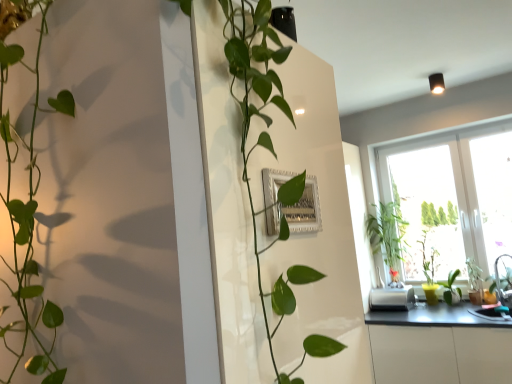
Where is `free space above green glossy plant at right, the 2th plant viewed from the right (from a real-world perspective)`? This screenshot has height=384, width=512. free space above green glossy plant at right, the 2th plant viewed from the right (from a real-world perspective) is located at coordinates (448, 269).